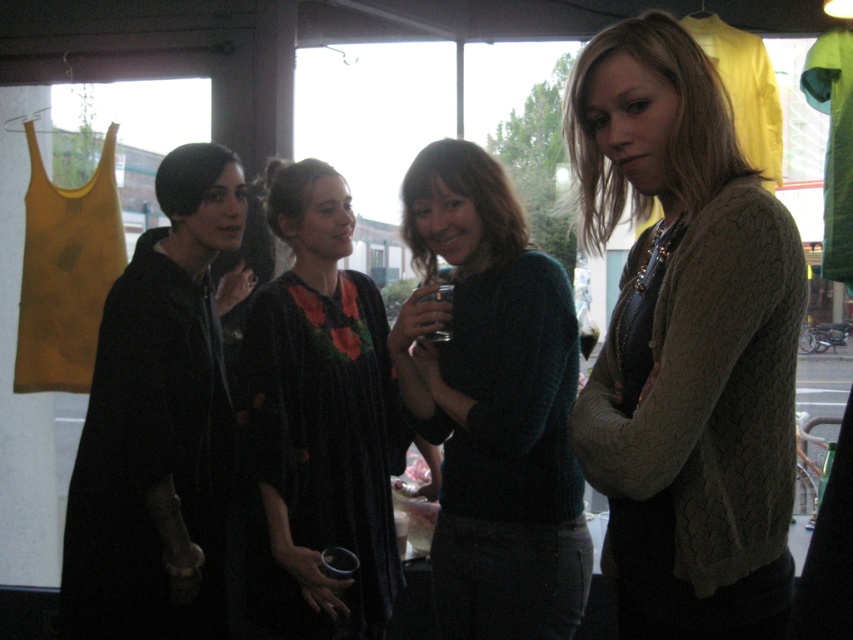
Describe the element at coordinates (318, 419) in the screenshot. This screenshot has height=640, width=853. I see `velvet black dress at center` at that location.

This screenshot has height=640, width=853. I want to click on velvet black dress at center, so tap(318, 419).

How much distance is there between knitted teal sweater at center and black matte coat at left?

23.28 inches

Is knitted teal sweater at center closer to the viewer compared to black matte coat at left?

Yes, knitted teal sweater at center is closer to the viewer.

Image resolution: width=853 pixels, height=640 pixels. Identify the location of knitted teal sweater at center. (492, 403).

This screenshot has width=853, height=640. Identify the location of knitted teal sweater at center. (492, 403).

Does point (628, 592) lie in front of point (387, 348)?

Yes, it is in front of point (387, 348).

The width and height of the screenshot is (853, 640). I want to click on cable-knit sweater at center, so point(686,342).